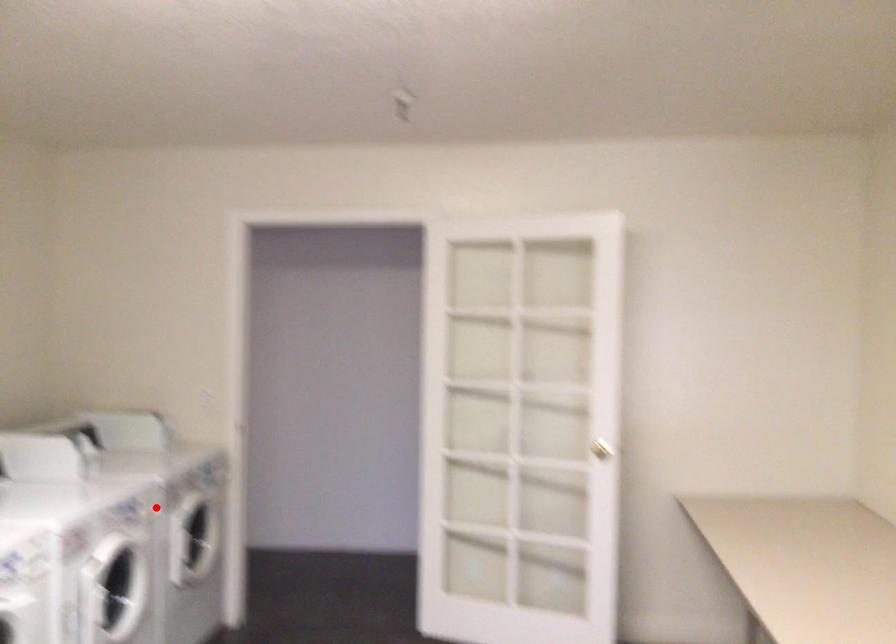
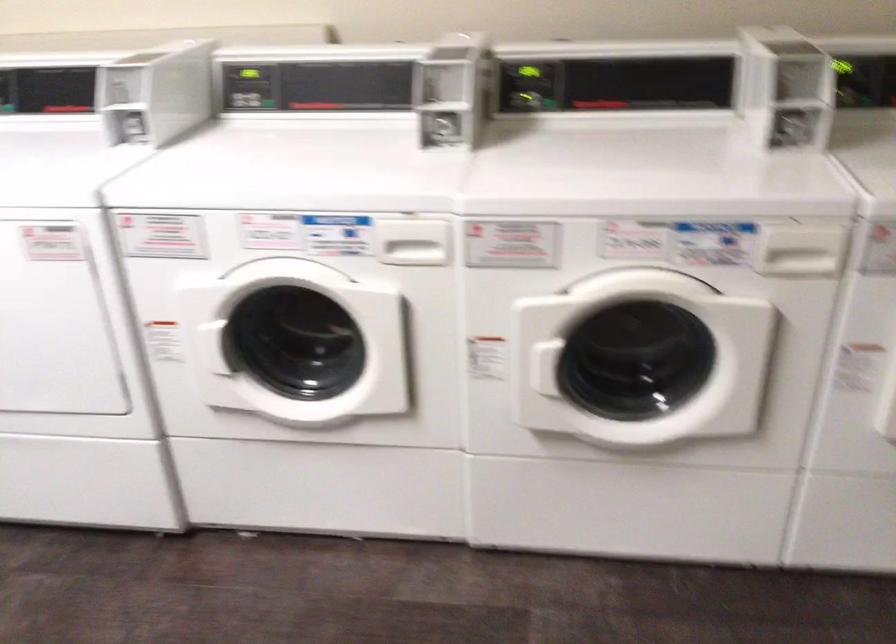
Find the pixel in the second image that matches the highlighted location in the first image.

(800, 251)